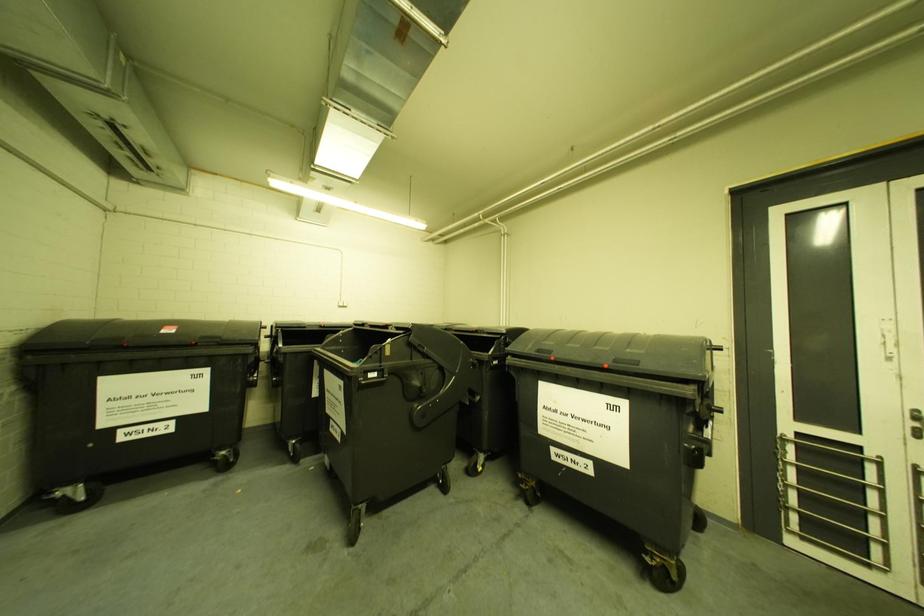
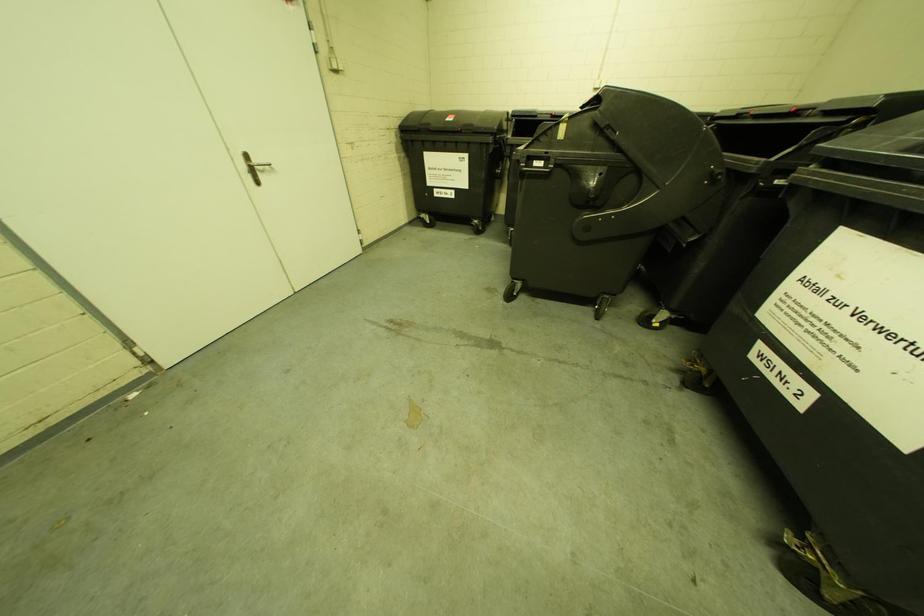
The first image is from the beginning of the video and the second image is from the end. How did the camera likely rotate when shooting the video?

The camera's rotation is toward left-down.